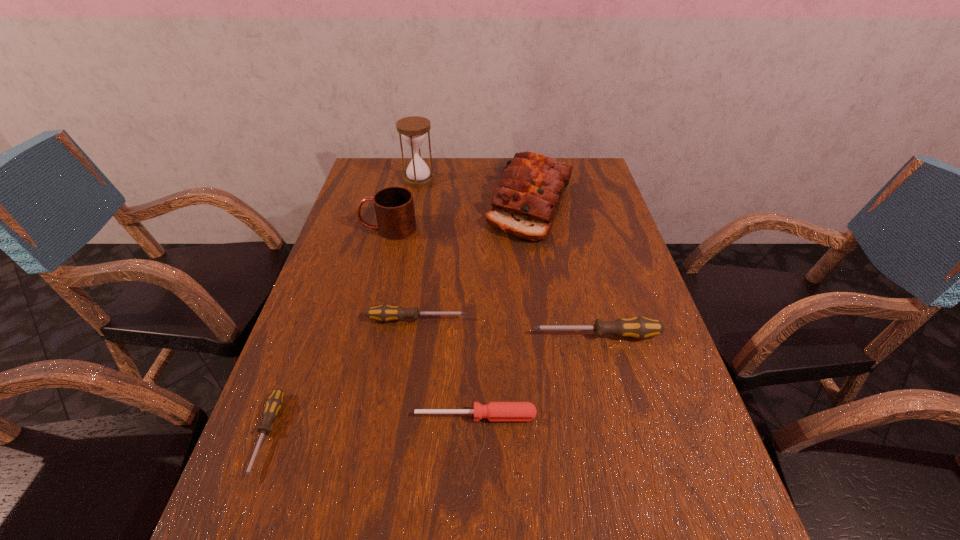
Identify the location of white hourglass. (414, 129).

At what (x,y) coordinates should I click in order to perform the action: click on hourglass. Please return your answer as a coordinate pair (x, y). Looking at the image, I should click on (414, 129).

Where is `bread`? This screenshot has width=960, height=540. bread is located at coordinates (525, 203).

The height and width of the screenshot is (540, 960). Identify the location of mug. (394, 206).

Where is `the fifth shortest object`? This screenshot has width=960, height=540. the fifth shortest object is located at coordinates click(394, 206).

The image size is (960, 540). I want to click on the second nearest gray screwdriver, so click(638, 327).

Where is `the fourth tallest object`? The image size is (960, 540). the fourth tallest object is located at coordinates (638, 327).

At what (x,y) coordinates should I click in order to perform the action: click on the second gray screwdriver from right to left. Please return your answer as a coordinate pair (x, y). Looking at the image, I should click on (384, 313).

Locate an element on the screen. The image size is (960, 540). the fourth farthest object is located at coordinates (384, 313).

Locate an element on the screen. Image resolution: width=960 pixels, height=540 pixels. red screwdriver is located at coordinates (x=494, y=411).